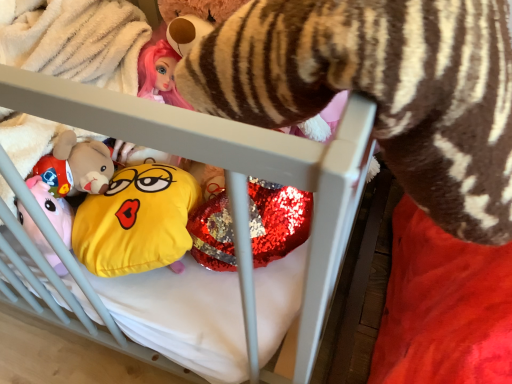
Question: From a real-world perspective, is yellow fabric emoji pillow at center physically located above or below white plastic crib at center?

Choices:
 (A) below
 (B) above

Answer: (A)

Question: In terms of size, does yellow fabric emoji pillow at center appear bigger or smaller than white plastic crib at center?

Choices:
 (A) big
 (B) small

Answer: (B)

Question: Visually, is yellow fabric emoji pillow at center positioned to the left or to the right of white plastic crib at center?

Choices:
 (A) right
 (B) left

Answer: (A)

Question: Is white plastic crib at center to the left or to the right of yellow fabric emoji pillow at center in the image?

Choices:
 (A) right
 (B) left

Answer: (B)

Question: In the image, is white plastic crib at center positioned in front of or behind yellow fabric emoji pillow at center?

Choices:
 (A) behind
 (B) front

Answer: (B)

Question: In terms of size, does white plastic crib at center appear bigger or smaller than yellow fabric emoji pillow at center?

Choices:
 (A) big
 (B) small

Answer: (A)

Question: From their relative heights in the image, would you say white plastic crib at center is taller or shorter than yellow fabric emoji pillow at center?

Choices:
 (A) short
 (B) tall

Answer: (B)